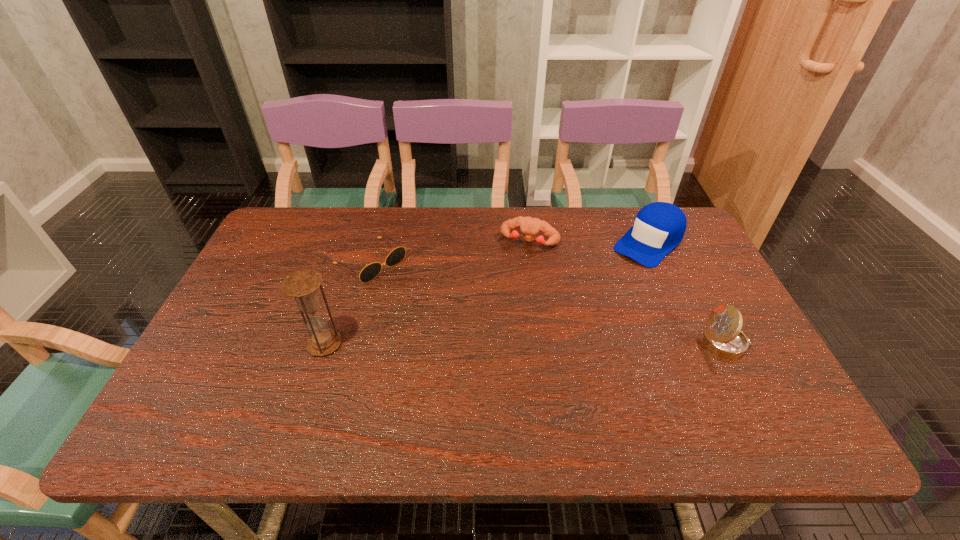
Locate an element on the screen. blank area located 0.190m with the gloves of the third object from right to left facing forward is located at coordinates (505, 294).

This screenshot has height=540, width=960. I want to click on free location located with the gloves of the third object from right to left facing forward, so click(x=504, y=296).

Locate an element on the screen. The image size is (960, 540). vacant point located 0.230m with the gloves of the third object from right to left facing forward is located at coordinates (501, 304).

You are a GUI agent. You are given a task and a screenshot of the screen. Output one action in this format:
    pyautogui.click(x=<x>, y=<y>)
    Task: Click on the free space located 0.400m on the front-facing side of the baseball cap
    This screenshot has width=960, height=540.
    Given the screenshot: What is the action you would take?
    pyautogui.click(x=546, y=337)

Where is `free point located on the front-facing side of the baseball cap`? The image size is (960, 540). free point located on the front-facing side of the baseball cap is located at coordinates (586, 301).

Image resolution: width=960 pixels, height=540 pixels. What are the coordinates of `free point located 0.320m on the front-facing side of the baseball cap` in the screenshot? It's located at (565, 319).

Image resolution: width=960 pixels, height=540 pixels. I want to click on sunglasses that is at the far edge, so click(368, 273).

The image size is (960, 540). What are the coordinates of `puncher that is at the far edge` in the screenshot? It's located at (530, 227).

Where is `baseball cap present at the far edge`? The width and height of the screenshot is (960, 540). baseball cap present at the far edge is located at coordinates (659, 227).

At what (x,y) coordinates should I click in order to perform the action: click on compass that is at the right edge. Please return your answer as a coordinate pair (x, y). The width and height of the screenshot is (960, 540). Looking at the image, I should click on (723, 336).